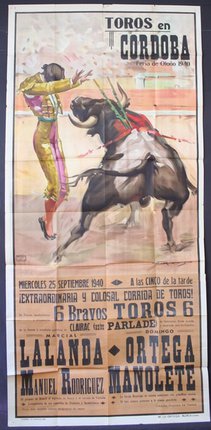
Image resolution: width=211 pixels, height=430 pixels. Identify the location of wall. (167, 96).